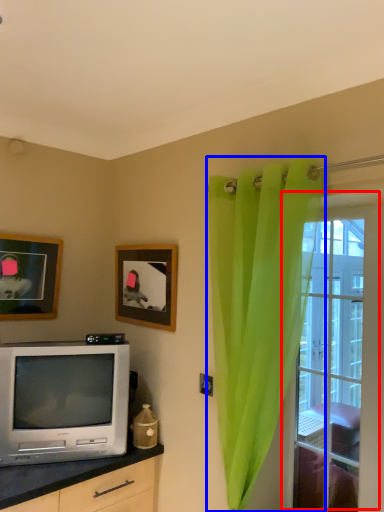
Question: Among these objects, which one is nearest to the camera, window (highlighted by a red box) or curtain (highlighted by a blue box)?

Choices:
 (A) window
 (B) curtain

Answer: (B)